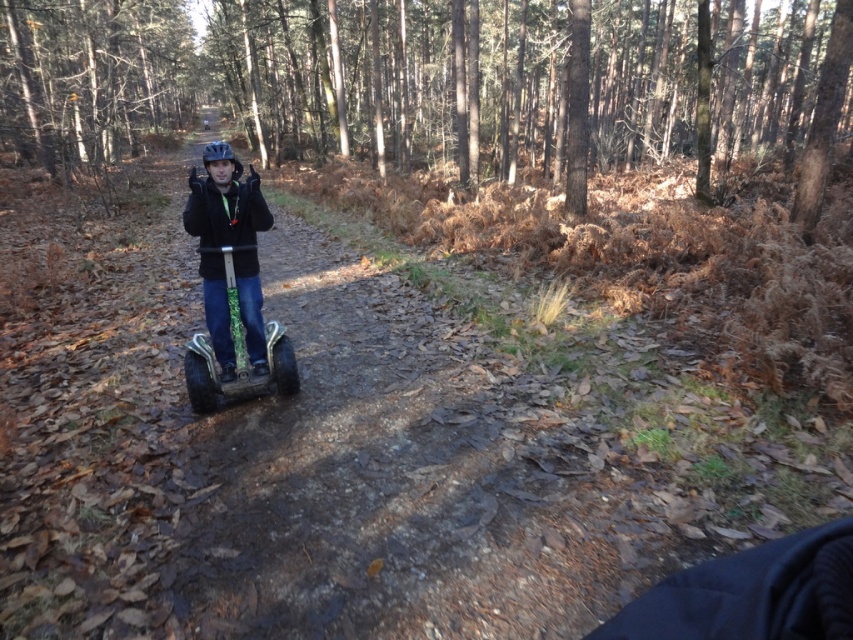
Which is below, brown matte forest at center or matte black helmet at center?

matte black helmet at center is below.

Can you confirm if brown matte forest at center is positioned to the left of matte black helmet at center?

Indeed, brown matte forest at center is positioned on the left side of matte black helmet at center.

Is point (294, 106) closer to viewer compared to point (219, 182)?

No, it is behind (219, 182).

Locate an element on the screen. Image resolution: width=853 pixels, height=640 pixels. brown matte forest at center is located at coordinates (438, 83).

You are a GUI agent. You are given a task and a screenshot of the screen. Output one action in this format:
    pyautogui.click(x=<x>, y=<y>)
    Task: Click on the brown matte forest at center
    
    Given the screenshot: What is the action you would take?
    pyautogui.click(x=438, y=83)

Which is below, brown matte forest at center or green textured segway at center?

green textured segway at center is lower down.

You are a GUI agent. You are given a task and a screenshot of the screen. Output one action in this format:
    pyautogui.click(x=<x>, y=<y>)
    Task: Click on the brown matte forest at center
    
    Given the screenshot: What is the action you would take?
    pyautogui.click(x=438, y=83)

Is matte black helmet at center further to the viewer compared to green textured segway at center?

No, matte black helmet at center is in front of green textured segway at center.

Does point (206, 308) come in front of point (193, 339)?

Yes, it is.

Who is more distant from viewer, (209, 148) or (218, 387)?

Answer: Positioned behind is point (218, 387).

The image size is (853, 640). I want to click on matte black helmet at center, so click(231, 232).